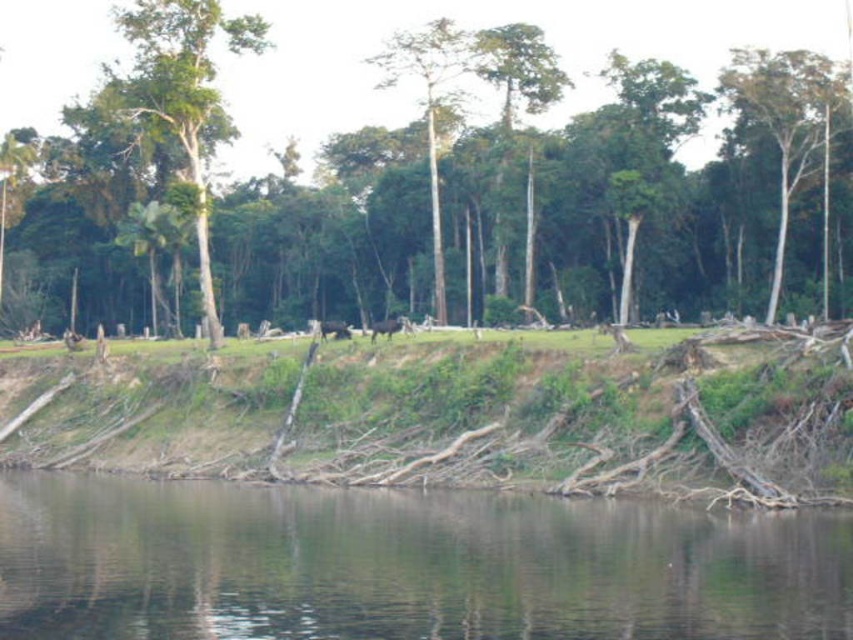
Who is positioned more to the right, dark brown water at lower center or brown fur animal at center?

Positioned to the right is dark brown water at lower center.

Is dark brown water at lower center positioned before brown fur animal at center?

Yes.

Who is more distant from viewer, (555, 508) or (405, 320)?

Positioned behind is point (405, 320).

Locate an element on the screen. The width and height of the screenshot is (853, 640). dark brown water at lower center is located at coordinates pos(402,564).

Based on the photo, can you confirm if white smooth tree at upper right is thinner than smooth bark tree at center?

No.

Locate an element on the screen. white smooth tree at upper right is located at coordinates (785, 120).

In the scene shown: Can you confirm if smooth bark tree at center is bigger than brown furry animal at center?

Correct, smooth bark tree at center is larger in size than brown furry animal at center.

Between point (422, 29) and point (328, 332), which one is positioned in front?

Point (328, 332)

This screenshot has width=853, height=640. I want to click on smooth bark tree at center, so click(431, 106).